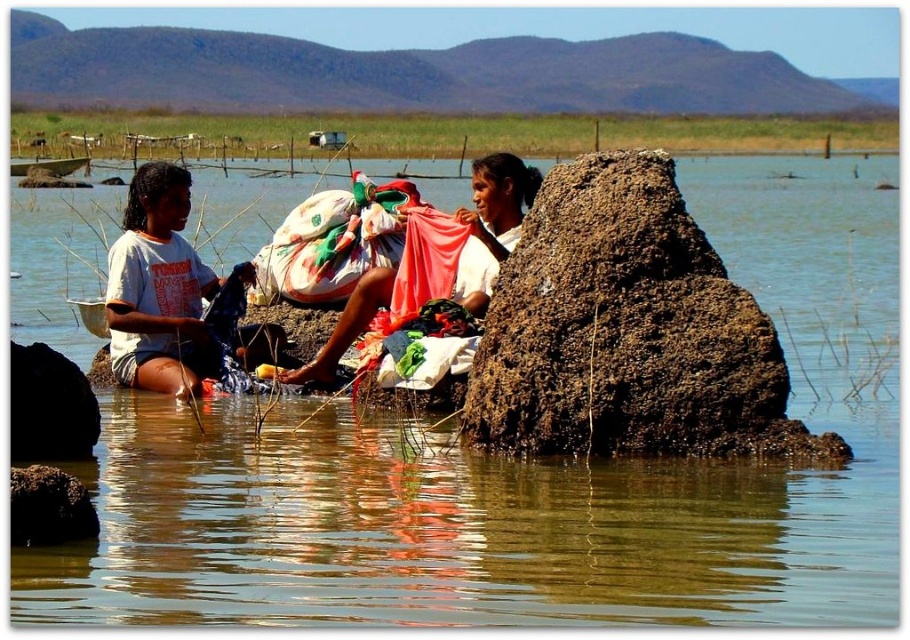
You are standing at the center of the scene and want to move to the brown mud rock at right. Which direction should you go from the brown mud rock at lower left?

The brown mud rock at right is located to the right of the brown mud rock at lower left, so you should move to the right from the brown mud rock at lower left to reach it.

What is the exact coordinate of clear water at center?

The clear water at center is located at coordinate point (531, 477).

You are standing at the edge of the water and need to place a small basket on the higher brown mud rock. Which one should you choose between the brown mud rock at right and the brown mud rock at lower left?

The brown mud rock at lower left is higher than the brown mud rock at right, so you should place the basket on the brown mud rock at lower left.